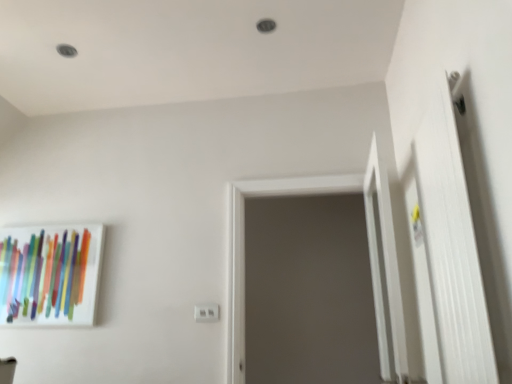
Question: Is white plastic electric outlet at center oriented towards white matte door at right?

Choices:
 (A) no
 (B) yes

Answer: (A)

Question: Can you confirm if white plastic electric outlet at center is bigger than white matte door at right?

Choices:
 (A) yes
 (B) no

Answer: (B)

Question: Is white plastic electric outlet at center at the left side of white matte door at right?

Choices:
 (A) yes
 (B) no

Answer: (A)

Question: Does white plastic electric outlet at center contain white matte door at right?

Choices:
 (A) no
 (B) yes

Answer: (A)

Question: Does white plastic electric outlet at center have a smaller size compared to white matte door at right?

Choices:
 (A) no
 (B) yes

Answer: (B)

Question: Looking at their shapes, would you say white plastic electric outlet at center is wider or thinner than matte glass picture frame at left?

Choices:
 (A) wide
 (B) thin

Answer: (B)

Question: Which is correct: white plastic electric outlet at center is inside matte glass picture frame at left, or outside of it?

Choices:
 (A) outside
 (B) inside

Answer: (A)

Question: Considering the positions of point (x=202, y=317) and point (x=7, y=314), is point (x=202, y=317) closer or farther from the camera than point (x=7, y=314)?

Choices:
 (A) farther
 (B) closer

Answer: (B)

Question: Based on their positions, is white plastic electric outlet at center located to the left or right of matte glass picture frame at left?

Choices:
 (A) left
 (B) right

Answer: (B)

Question: From the image's perspective, is gray matte screen door at center located above or below white plastic electric outlet at center?

Choices:
 (A) below
 (B) above

Answer: (B)

Question: Is gray matte screen door at center taller or shorter than white plastic electric outlet at center?

Choices:
 (A) short
 (B) tall

Answer: (B)

Question: Considering the positions of point (237, 188) and point (206, 302), is point (237, 188) closer or farther from the camera than point (206, 302)?

Choices:
 (A) farther
 (B) closer

Answer: (A)

Question: Considering the positions of gray matte screen door at center and white plastic electric outlet at center in the image, is gray matte screen door at center bigger or smaller than white plastic electric outlet at center?

Choices:
 (A) big
 (B) small

Answer: (A)

Question: Is white plastic electric outlet at center inside or outside of gray matte screen door at center?

Choices:
 (A) inside
 (B) outside

Answer: (B)

Question: Is white plastic electric outlet at center taller or shorter than gray matte screen door at center?

Choices:
 (A) short
 (B) tall

Answer: (A)